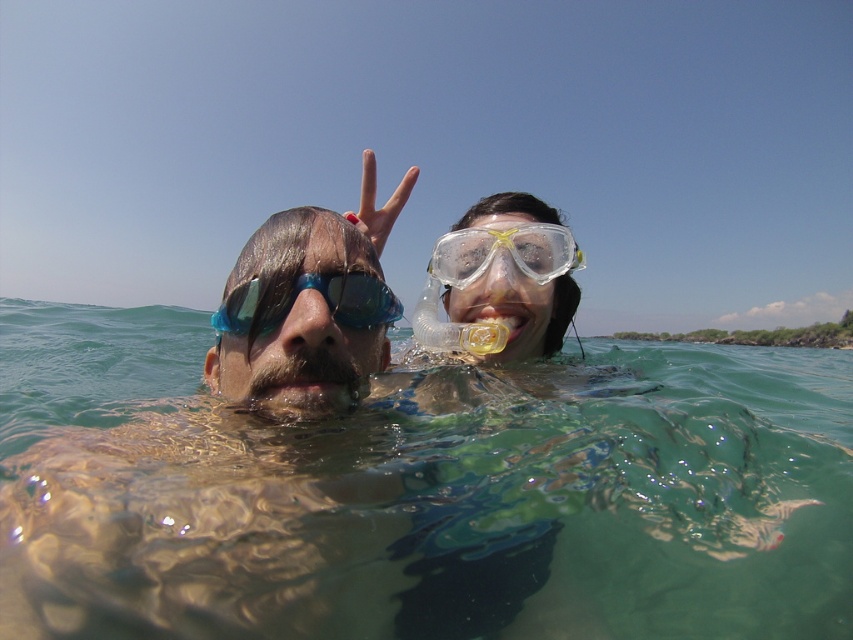
Question: Which point is closer to the camera taking this photo?

Choices:
 (A) (216, 316)
 (B) (318, 435)

Answer: (B)

Question: Which of the following is the closest to the observer?

Choices:
 (A) (581, 502)
 (B) (488, 259)
 (C) (376, 294)

Answer: (C)

Question: Observing the image, what is the correct spatial positioning of blue reflective goggles at center in reference to clear plastic goggles at upper right?

Choices:
 (A) left
 (B) right

Answer: (A)

Question: Is clear water at center bigger than blue reflective goggles at center?

Choices:
 (A) yes
 (B) no

Answer: (A)

Question: Among these objects, which one is farthest from the camera?

Choices:
 (A) clear water at center
 (B) clear plastic goggles at upper right

Answer: (B)

Question: Is clear water at center positioned in front of blue reflective goggles at center?

Choices:
 (A) yes
 (B) no

Answer: (A)